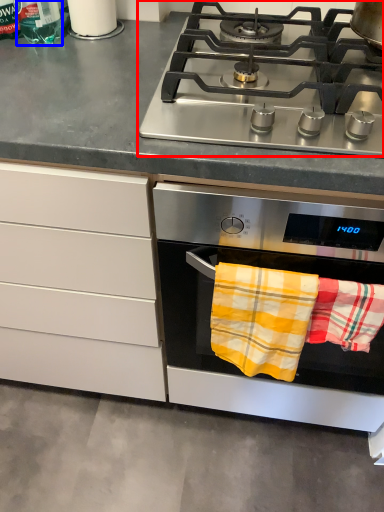
Question: Which point is further to the camera, gas stove (highlighted by a red box) or bottle (highlighted by a blue box)?

Choices:
 (A) gas stove
 (B) bottle

Answer: (B)